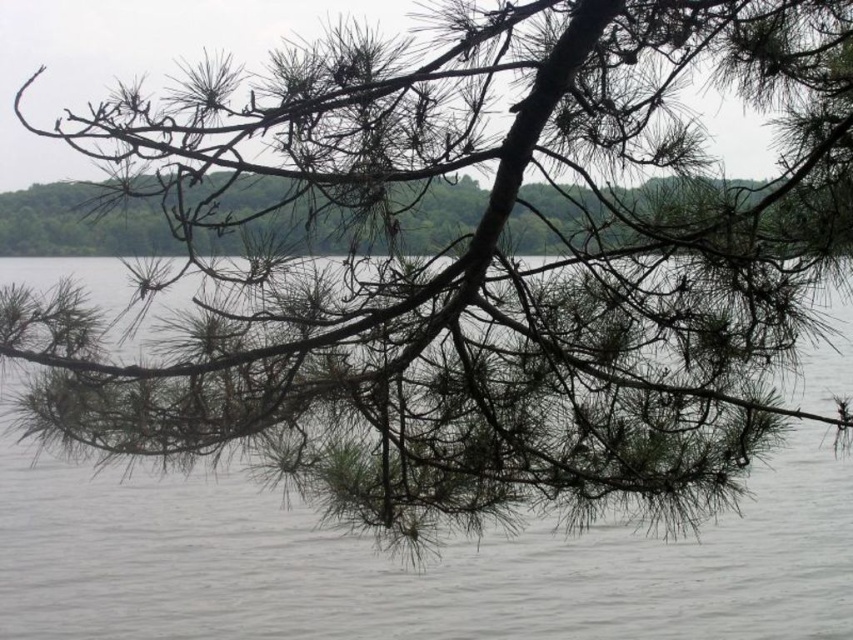
Question: Which of the following is the farthest from the observer?

Choices:
 (A) brown textured pine branch at center
 (B) gray matte water at center

Answer: (B)

Question: Does gray matte water at center have a lesser width compared to brown textured pine branch at center?

Choices:
 (A) yes
 (B) no

Answer: (B)

Question: Is gray matte water at center to the left of brown textured pine branch at center from the viewer's perspective?

Choices:
 (A) no
 (B) yes

Answer: (A)

Question: Is gray matte water at center thinner than brown textured pine branch at center?

Choices:
 (A) yes
 (B) no

Answer: (B)

Question: Among these objects, which one is farthest from the camera?

Choices:
 (A) brown textured pine branch at center
 (B) gray matte water at center

Answer: (B)